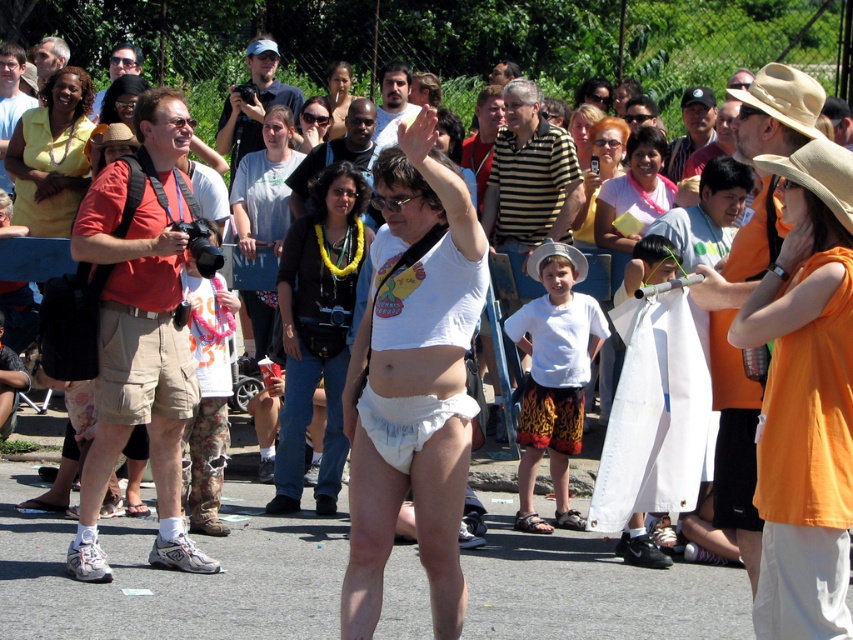
You are a photographer at the event and want to capture both the matte yellow sunglasses at upper center and the white fabric cowboy hat at center in a single frame. Given their sizes, which object would you need to position closer to the camera to ensure both fit within the frame?

The matte yellow sunglasses at upper center is wider than the white fabric cowboy hat at center. To fit both in the frame, position the wider matte yellow sunglasses at upper center closer to the camera so its apparent size reduces, allowing both to fit within the frame.

Based on the photo, you are a photographer at the event and want to capture both the white cotton bikini top at center and the orange cotton shirt at upper right in the same frame. Which object should you focus on first to ensure both are in the frame?

The white cotton bikini top at center is positioned on the left side of orange cotton shirt at upper right, so you should focus on the white cotton bikini top at center first to ensure both are in the frame.

You are standing in the crowd at the event and want to locate the matte yellow sunglasses at upper center. Based on the coordinates provided, which object in the scene is located at point [599,172]?

The point [599,172] corresponds to the matte yellow sunglasses at upper center.